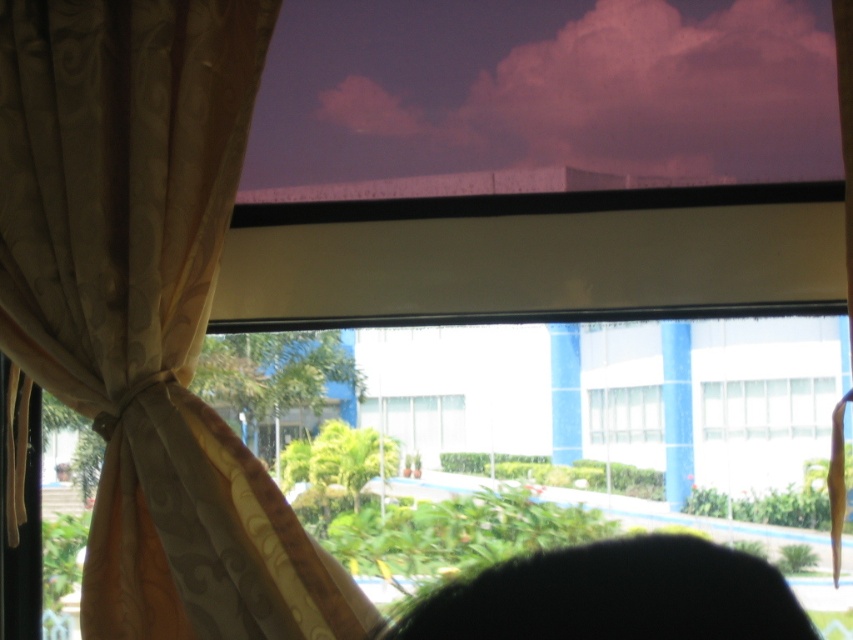
You are an interior designer assessing the lighting in a room. You notice the purple fabric blind at upper center and the white glass window at center. Which object is located above the other?

The purple fabric blind at upper center is positioned over the white glass window at center, so it is above the window.

Looking at this image, you are standing in a room with the window described. You want to touch the black hair at lower center. Can you reach it without moving your position?

The black hair at lower center is 23.34 inches away from you, so if you can extend your arm that far, you can reach it.